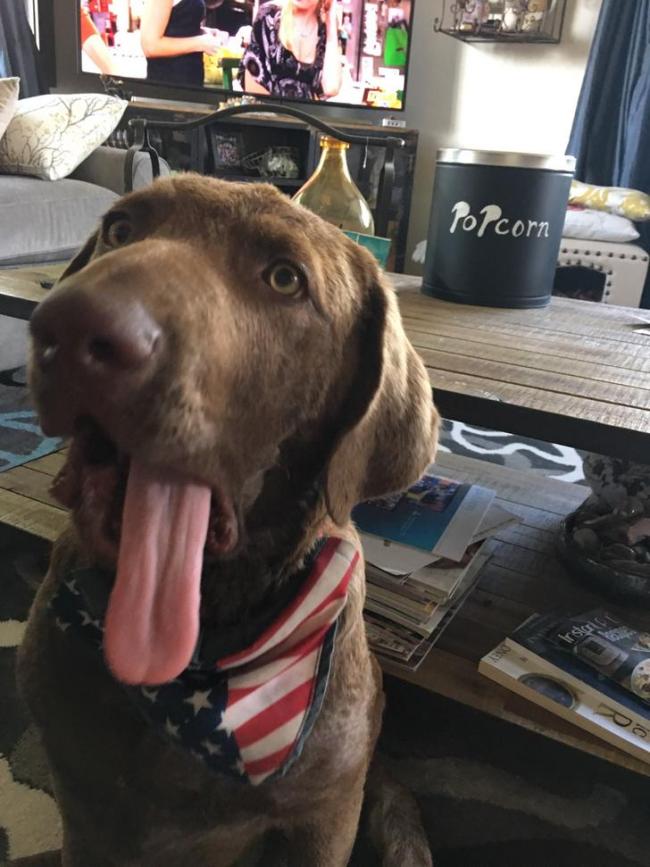
This screenshot has height=867, width=650. What are the coordinates of `gray couch left upper corner` in the screenshot? It's located at click(x=51, y=211).